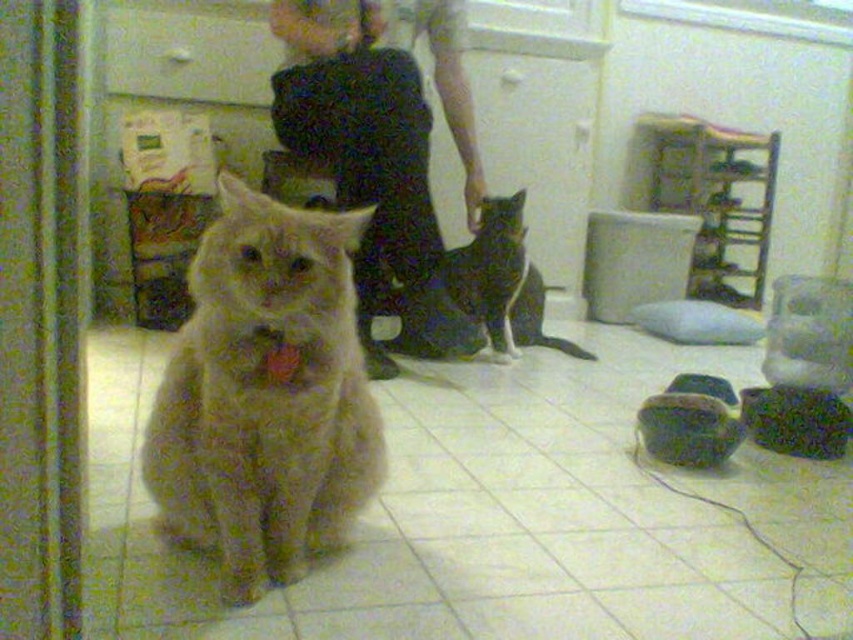
Is fuzzy brown cat at center to the right of black and white fur cat at center from the viewer's perspective?

Incorrect, fuzzy brown cat at center is not on the right side of black and white fur cat at center.

Is fuzzy brown cat at center taller than black and white fur cat at center?

Yes.

Find the location of a particular element. This screenshot has height=640, width=853. fuzzy brown cat at center is located at coordinates click(265, 396).

Is fuzzy brown cat at center shorter than fluffy orange cat at center?

Incorrect, fuzzy brown cat at center's height does not fall short of fluffy orange cat at center's.

Which is more to the left, fuzzy brown cat at center or fluffy orange cat at center?

fuzzy brown cat at center

At what (x,y) coordinates should I click in order to perform the action: click on fuzzy brown cat at center. Please return your answer as a coordinate pair (x, y). The image size is (853, 640). Looking at the image, I should click on (265, 396).

Find the location of a particular element. The height and width of the screenshot is (640, 853). fuzzy brown cat at center is located at coordinates click(x=265, y=396).

Is matte black pants at center closer to the viewer compared to fluffy orange cat at center?

No.

Measure the distance between matte black pants at center and camera.

matte black pants at center and camera are 7.55 feet apart from each other.

Where is `matte black pants at center`? matte black pants at center is located at coordinates (364, 148).